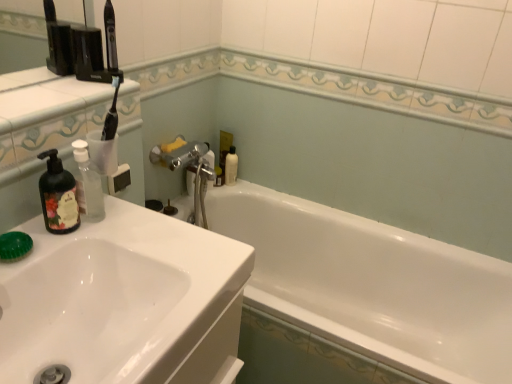
Question: Is white glossy sink at left looking in the opposite direction of white glossy bathtub at center?

Choices:
 (A) no
 (B) yes

Answer: (A)

Question: Does white glossy sink at left turn towards white glossy bathtub at center?

Choices:
 (A) yes
 (B) no

Answer: (B)

Question: From a real-world perspective, is white glossy sink at left on top of white glossy bathtub at center?

Choices:
 (A) yes
 (B) no

Answer: (A)

Question: From a real-world perspective, does white glossy sink at left sit lower than white glossy bathtub at center?

Choices:
 (A) yes
 (B) no

Answer: (B)

Question: Is white glossy sink at left in front of white glossy bathtub at center?

Choices:
 (A) yes
 (B) no

Answer: (A)

Question: Considering the relative positions of white glossy sink at left and white glossy bathtub at center in the image provided, is white glossy sink at left to the left of white glossy bathtub at center from the viewer's perspective?

Choices:
 (A) yes
 (B) no

Answer: (A)

Question: From the image's perspective, does white glossy bathtub at center appear lower than clear plastic bottle at left?

Choices:
 (A) no
 (B) yes

Answer: (B)

Question: Would you say white glossy bathtub at center is outside clear plastic bottle at left?

Choices:
 (A) yes
 (B) no

Answer: (A)

Question: Does white glossy bathtub at center have a lesser width compared to clear plastic bottle at left?

Choices:
 (A) yes
 (B) no

Answer: (B)

Question: Considering the relative sizes of white glossy bathtub at center and clear plastic bottle at left in the image provided, is white glossy bathtub at center wider than clear plastic bottle at left?

Choices:
 (A) yes
 (B) no

Answer: (A)

Question: Is white glossy bathtub at center taller than clear plastic bottle at left?

Choices:
 (A) yes
 (B) no

Answer: (A)

Question: From a real-world perspective, does white glossy bathtub at center sit lower than clear plastic bottle at left?

Choices:
 (A) yes
 (B) no

Answer: (A)

Question: Is translucent plastic bottle at upper center surrounding white glossy bathtub at center?

Choices:
 (A) yes
 (B) no

Answer: (B)